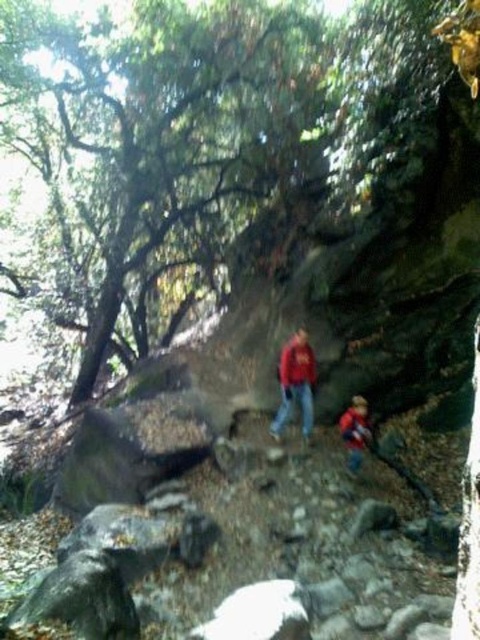
Question: Is red matte shirt at center further to camera compared to matte red jacket at center?

Choices:
 (A) yes
 (B) no

Answer: (B)

Question: Which object is the closest to the red matte shirt at center?

Choices:
 (A) green leafy tree at upper left
 (B) red fabric jacket at lower center
 (C) matte red jacket at center

Answer: (C)

Question: Can you confirm if red matte shirt at center is bigger than red fabric jacket at lower center?

Choices:
 (A) no
 (B) yes

Answer: (B)

Question: Does green leafy tree at upper left appear on the right side of matte red jacket at center?

Choices:
 (A) yes
 (B) no

Answer: (B)

Question: Which point appears farthest from the camera in this image?

Choices:
 (A) (288, 369)
 (B) (276, 435)
 (C) (354, 442)
 (D) (212, 198)

Answer: (D)

Question: Which object appears farthest from the camera in this image?

Choices:
 (A) red matte shirt at center
 (B) matte red jacket at center
 (C) red fabric jacket at lower center
 (D) green leafy tree at upper left

Answer: (D)